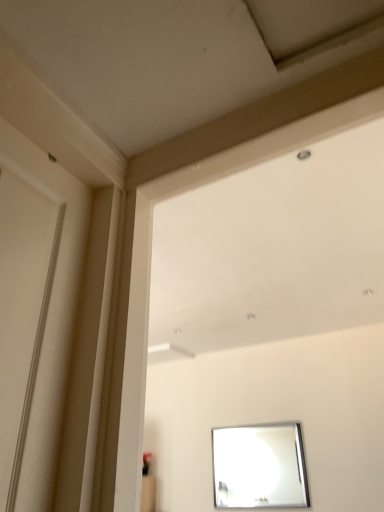
Question: Is white glossy window frame at upper center positioned with its back to silver metallic mirror at lower center?

Choices:
 (A) no
 (B) yes

Answer: (A)

Question: Would you say white glossy window frame at upper center is outside silver metallic mirror at lower center?

Choices:
 (A) no
 (B) yes

Answer: (B)

Question: Is white glossy window frame at upper center not close to silver metallic mirror at lower center?

Choices:
 (A) no
 (B) yes

Answer: (B)

Question: Is white glossy window frame at upper center wider than silver metallic mirror at lower center?

Choices:
 (A) no
 (B) yes

Answer: (B)

Question: Is white glossy window frame at upper center bigger than silver metallic mirror at lower center?

Choices:
 (A) yes
 (B) no

Answer: (A)

Question: Is the position of white glossy window frame at upper center more distant than that of silver metallic mirror at lower center?

Choices:
 (A) yes
 (B) no

Answer: (B)

Question: Considering the relative sizes of silver metallic mirror at lower center and white glossy window frame at upper center in the image provided, is silver metallic mirror at lower center taller than white glossy window frame at upper center?

Choices:
 (A) yes
 (B) no

Answer: (B)

Question: Is silver metallic mirror at lower center oriented towards white glossy window frame at upper center?

Choices:
 (A) yes
 (B) no

Answer: (A)

Question: Are silver metallic mirror at lower center and white glossy window frame at upper center far apart?

Choices:
 (A) yes
 (B) no

Answer: (A)

Question: From the image's perspective, is silver metallic mirror at lower center on top of white glossy window frame at upper center?

Choices:
 (A) yes
 (B) no

Answer: (B)

Question: Is silver metallic mirror at lower center smaller than white glossy window frame at upper center?

Choices:
 (A) no
 (B) yes

Answer: (B)

Question: Is silver metallic mirror at lower center thinner than white glossy window frame at upper center?

Choices:
 (A) yes
 (B) no

Answer: (A)

Question: Relative to silver metallic mirror at lower center, is white glossy window frame at upper center in front or behind?

Choices:
 (A) behind
 (B) front

Answer: (B)